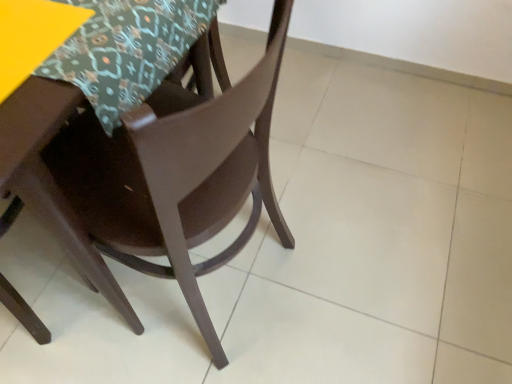
This screenshot has height=384, width=512. I want to click on free location to the right of matte brown chair at center, so 339,265.